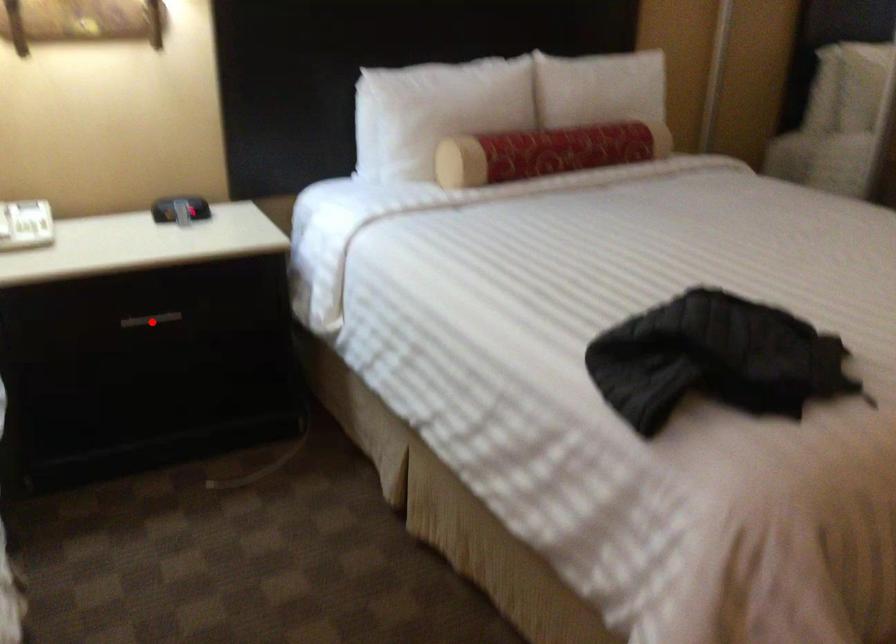
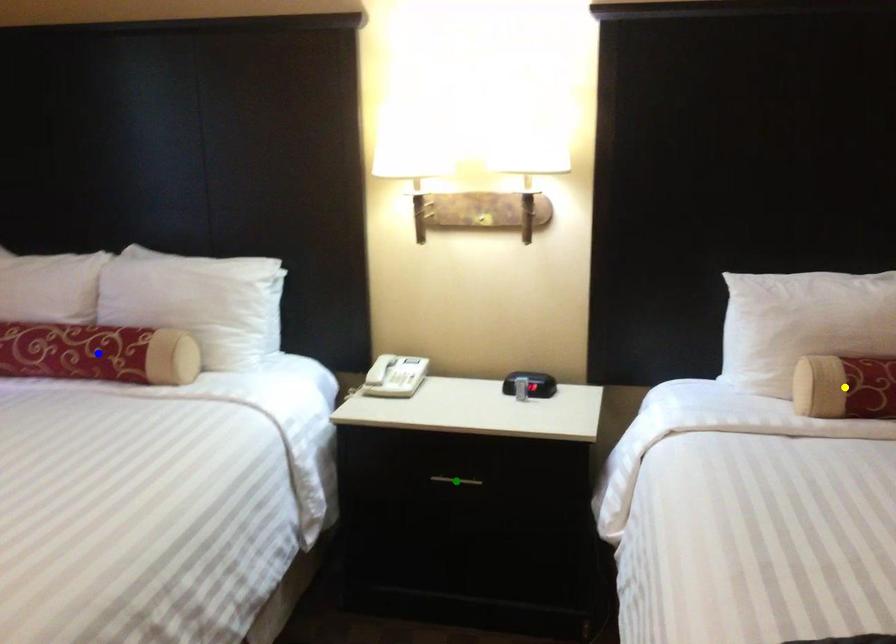
Question: I am providing you with two images of the same scene from different viewpoints. A red point is marked on the first image. You are given multiple points on the second image. Which point in image 2 is actually the same real-world point as the red point in image 1?

Choices:
 (A) green point
 (B) yellow point
 (C) blue point

Answer: (A)